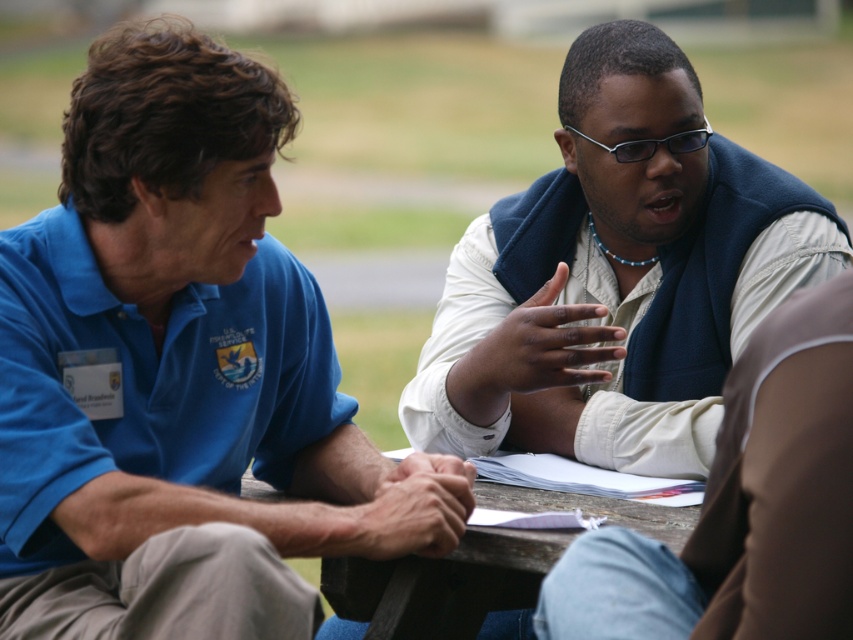
Question: Does blue cotton shirt at left lie behind wooden table at center?

Choices:
 (A) yes
 (B) no

Answer: (B)

Question: Which point is farther from the camera taking this photo?

Choices:
 (A) (192, 381)
 (B) (692, 492)
 (C) (643, 44)

Answer: (C)

Question: Where is blue cotton shirt at left located in relation to wooden table at center in the image?

Choices:
 (A) below
 (B) above

Answer: (B)

Question: Is light beige vest at center above wooden table at center?

Choices:
 (A) yes
 (B) no

Answer: (A)

Question: Which of the following is the closest to the observer?

Choices:
 (A) blue cotton shirt at left
 (B) wooden table at center

Answer: (A)

Question: Which point appears farthest from the camera in this image?

Choices:
 (A) (152, 486)
 (B) (358, 632)

Answer: (B)